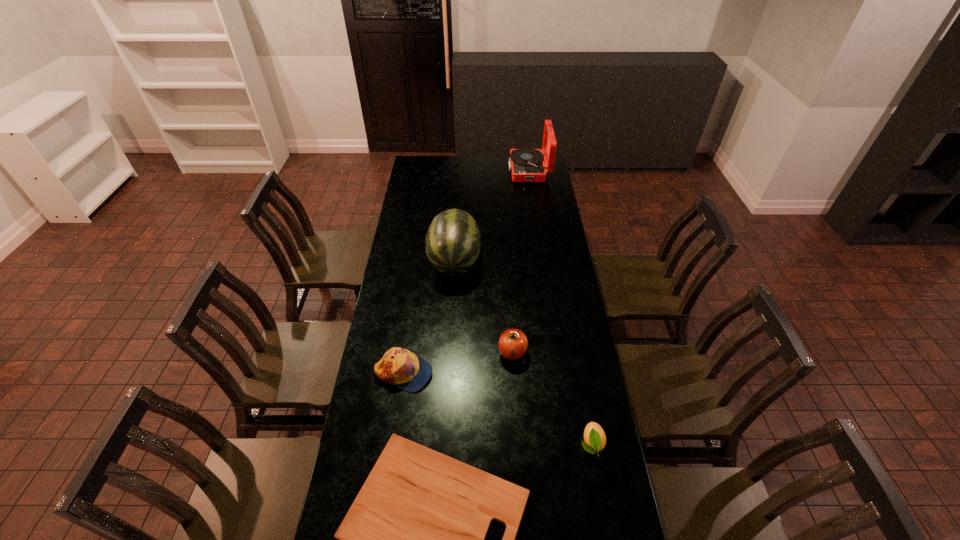
I want to click on phonograph_record, so click(x=527, y=165).

At what (x,y) coordinates should I click in order to perform the action: click on the fifth nearest object. Please return your answer as a coordinate pair (x, y). The image size is (960, 540). Looking at the image, I should click on (453, 239).

At what (x,y) coordinates should I click in order to perform the action: click on apple. Please return your answer as a coordinate pair (x, y). Looking at the image, I should click on (513, 343).

This screenshot has width=960, height=540. Find the location of `the third shortest object`. the third shortest object is located at coordinates [401, 367].

The width and height of the screenshot is (960, 540). I want to click on the fifth tallest object, so click(595, 439).

Locate an element on the screen. free spot located 0.220m on the front-facing side of the phonograph_record is located at coordinates (472, 170).

The height and width of the screenshot is (540, 960). Identify the location of vacant area located on the front-facing side of the phonograph_record. (480, 170).

Locate an element on the screen. free region located 0.340m on the front-facing side of the phonograph_record is located at coordinates click(x=452, y=170).

At what (x,y) coordinates should I click in order to perform the action: click on vacant space situated 0.210m on the back of the second farthest object. Please return your answer as a coordinate pair (x, y). The width and height of the screenshot is (960, 540). Looking at the image, I should click on (457, 213).

The height and width of the screenshot is (540, 960). I want to click on free region located 0.110m on the back of the apple, so click(x=511, y=319).